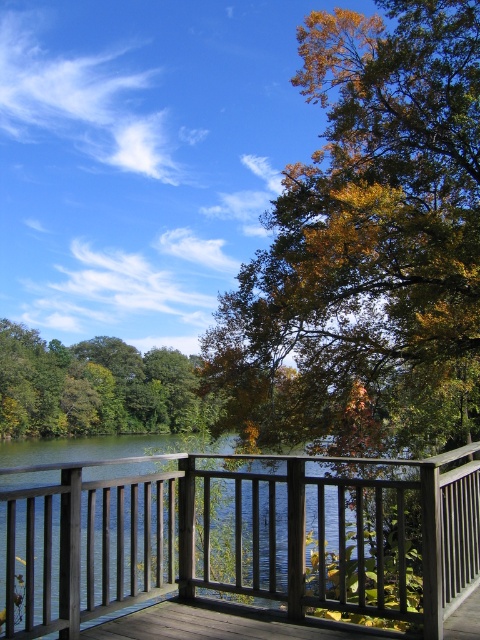
You are standing on the wooden deck and want to locate the wooden porch at center. According to the coordinates provided, where exactly would you find it?

The wooden porch at center is located at the coordinates point (243,534).

From the picture: You are standing on the wooden deck and want to place a small decorative pot between the golden yellow leaves at center and the green leafy tree at lower left. Which object should you place it closer to to ensure it fits within the available space?

The golden yellow leaves at center is smaller than the green leafy tree at lower left, so you should place the decorative pot closer to the golden yellow leaves at center to ensure it fits within the available space.